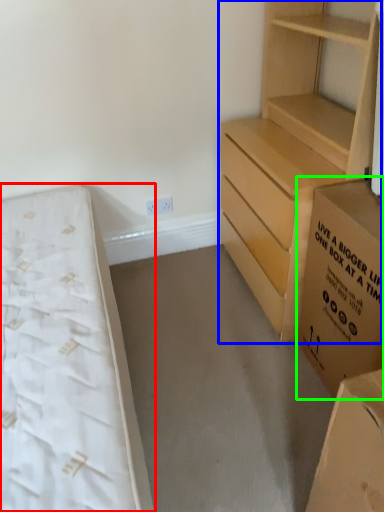
Question: Based on their relative distances, which object is farther from bed (highlighted by a red box)? Choose from chest of drawers (highlighted by a blue box) and cardboard box (highlighted by a green box).

Choices:
 (A) chest of drawers
 (B) cardboard box

Answer: (A)